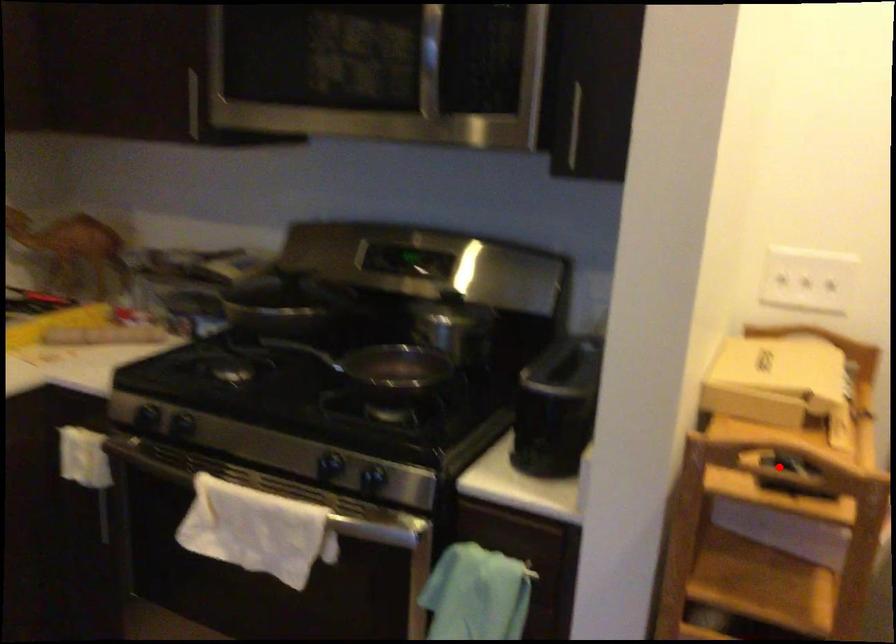
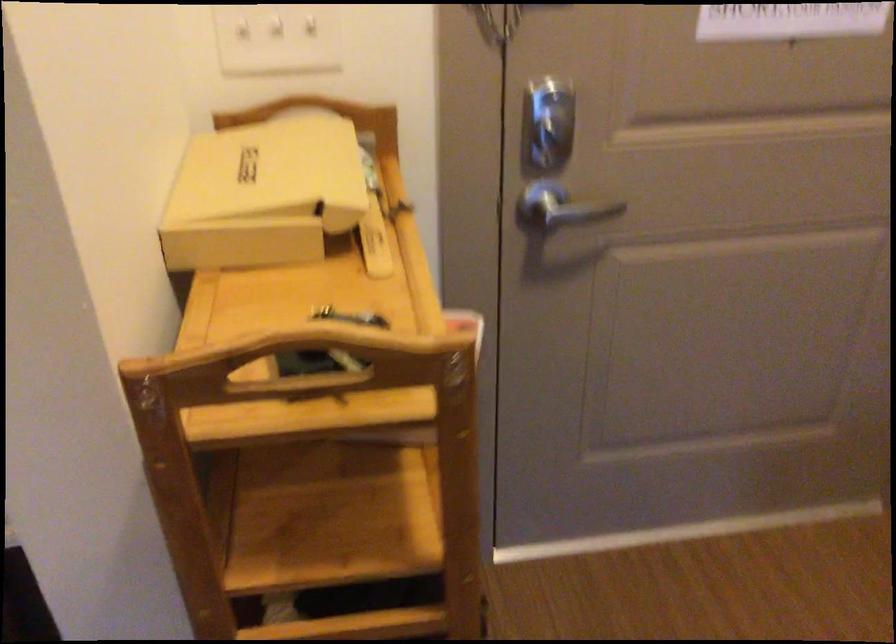
Question: I am providing you with two images of the same scene from different viewpoints. A red point is shown in image1. For the corresponding object point in image2, is it positioned nearer or farther from the camera?

Choices:
 (A) Nearer
 (B) Farther

Answer: (A)